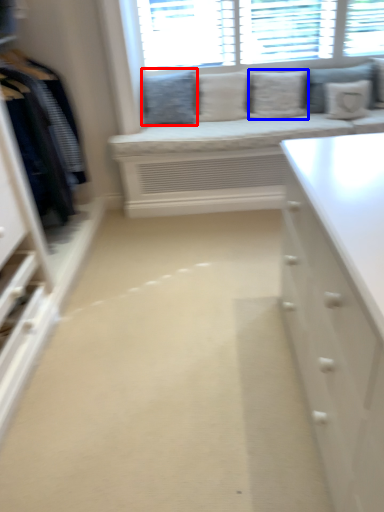
Question: Which object appears farthest to the camera in this image, pillow (highlighted by a red box) or pillow (highlighted by a blue box)?

Choices:
 (A) pillow
 (B) pillow

Answer: (A)